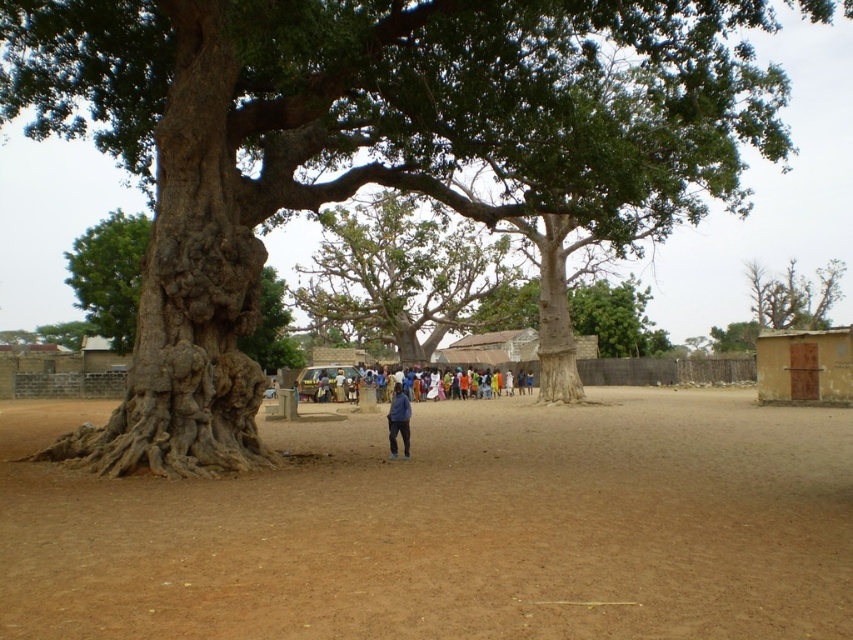
Question: Which of the following is the closest to the observer?

Choices:
 (A) green rough bark tree at upper left
 (B) multicolored fabric people at center
 (C) green rough bark tree at center

Answer: (A)

Question: Does brown sandy dirt field at center appear on the right side of brown mud hut at right?

Choices:
 (A) yes
 (B) no

Answer: (B)

Question: Which of the following is the closest to the observer?

Choices:
 (A) blue fabric jacket at center
 (B) green rough bark tree at upper left

Answer: (B)

Question: Can you confirm if brown sandy dirt field at center is thinner than green rough bark tree at center?

Choices:
 (A) yes
 (B) no

Answer: (B)

Question: Is brown sandy dirt field at center below blue fabric jacket at center?

Choices:
 (A) no
 (B) yes

Answer: (B)

Question: Which point is closer to the camera?

Choices:
 (A) (74, 538)
 (B) (270, 280)

Answer: (A)